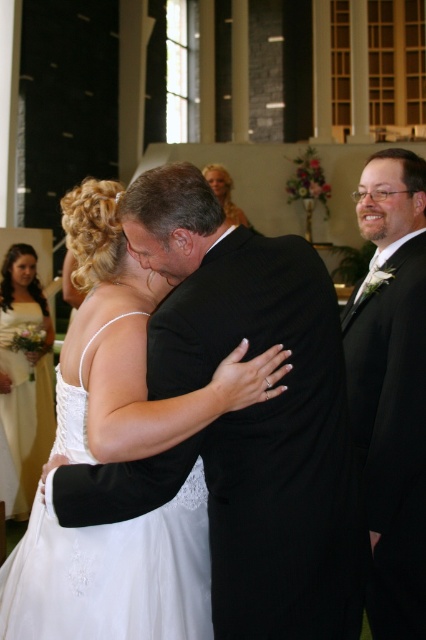
You are a photographer positioned at the front of the church during the wedding. You notice the white satin dress at left and the blonde hair at upper center in your viewfinder. Which object should you focus on first to ensure it is in sharp focus?

The white satin dress at left is closer to the viewer than the blonde hair at upper center, so you should focus on the white satin dress at left first to ensure it is in sharp focus.

You are a photographer positioned at the entrance of the church. You need to capture a closeup shot of the white satin dress at center. Based on its position, which direction should you move to get closer to it?

The white satin dress at center is located at point (131,349), so you should move forward towards the center of the church to get closer to it.

You are a photographer at the wedding ceremony. You need to capture a photo of the white satin dress at center and the blonde hair at upper center. Based on their sizes, which one should you focus on first to ensure it is fully in frame?

The white satin dress at center is taller than the blonde hair at upper center, so you should focus on the white satin dress at center first to ensure it is fully in frame.